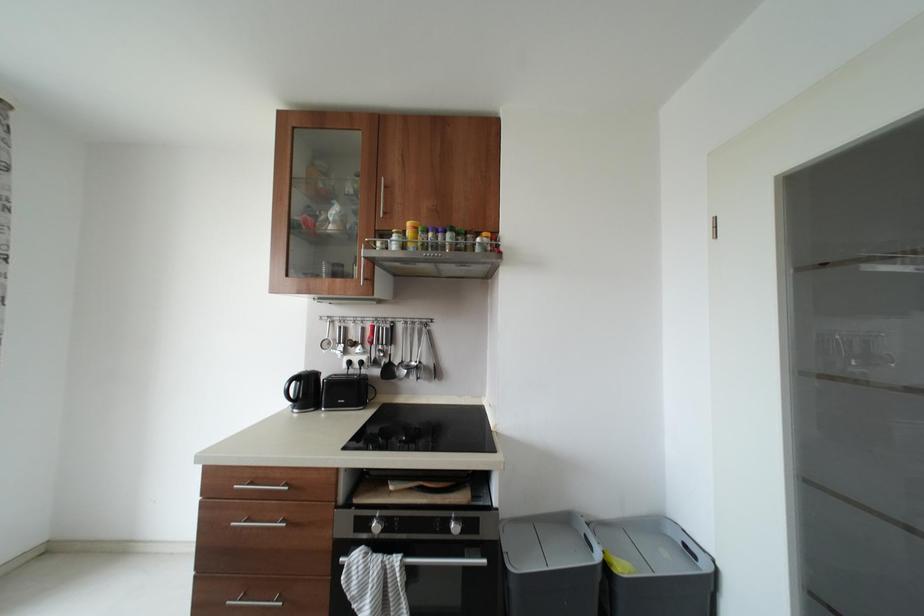
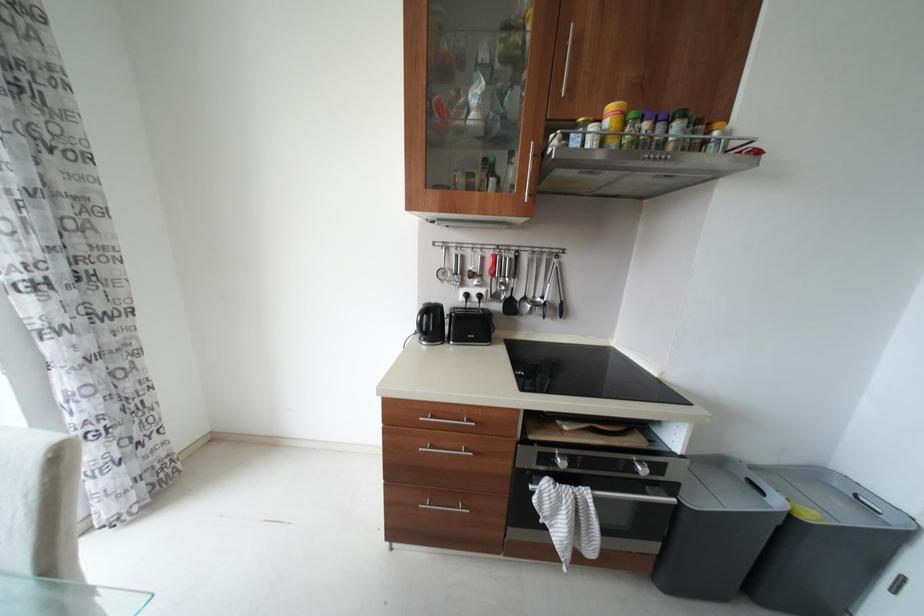
Question: The images are taken continuously from a first-person perspective. In which direction are you moving?

Choices:
 (A) Left
 (B) Right
 (C) Forward
 (D) Backward

Answer: (A)